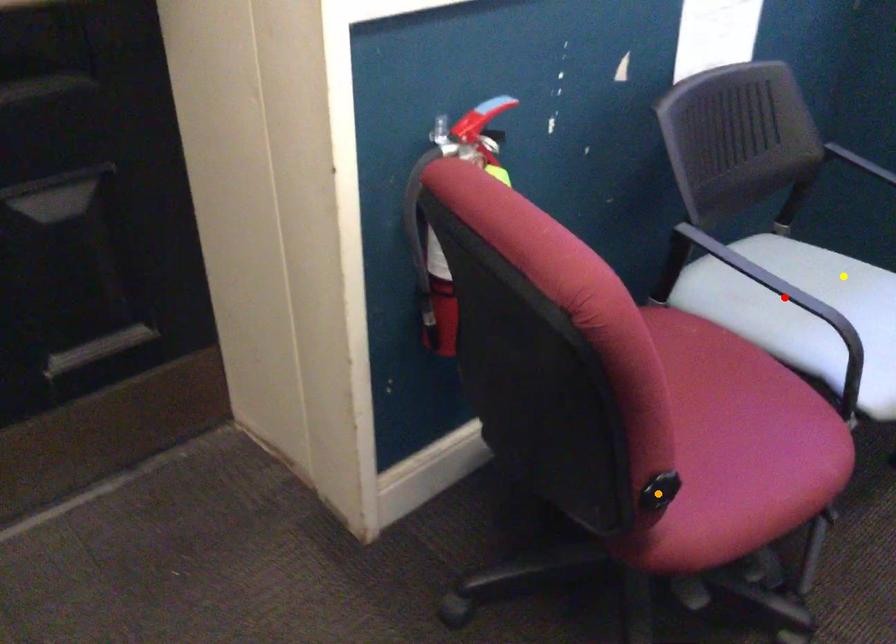
Order these from nearest to farthest:
red point, yellow point, orange point

orange point → red point → yellow point